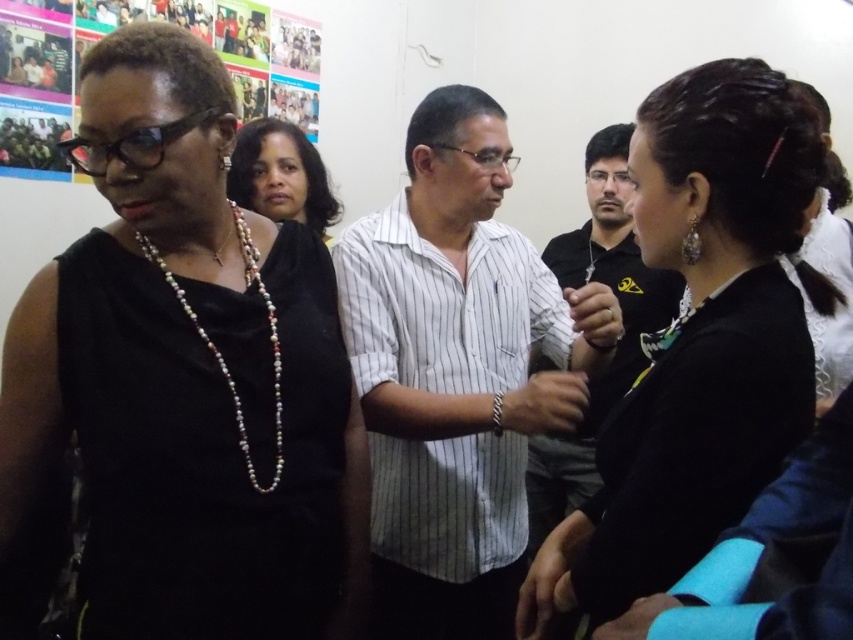
Question: Is multicolored fabric collage at upper left bigger than black striped shirt at center?

Choices:
 (A) no
 (B) yes

Answer: (A)

Question: Is black fabric hair at center positioned before multicolored fabric collage at upper left?

Choices:
 (A) yes
 (B) no

Answer: (A)

Question: Among these objects, which one is farthest from the camera?

Choices:
 (A) black fabric hair at center
 (B) white striped shirt at center

Answer: (B)

Question: Does black matte dress at left appear on the left side of pearl necklace at center?

Choices:
 (A) no
 (B) yes

Answer: (A)

Question: Which of the following is the farthest from the observer?

Choices:
 (A) pearl necklace at center
 (B) black matte dress at left

Answer: (A)

Question: Considering the real-world distances, which object is closest to the pearl beaded necklace at center?

Choices:
 (A) black fabric hair at center
 (B) black striped shirt at center
 (C) multicolored fabric collage at upper left

Answer: (A)